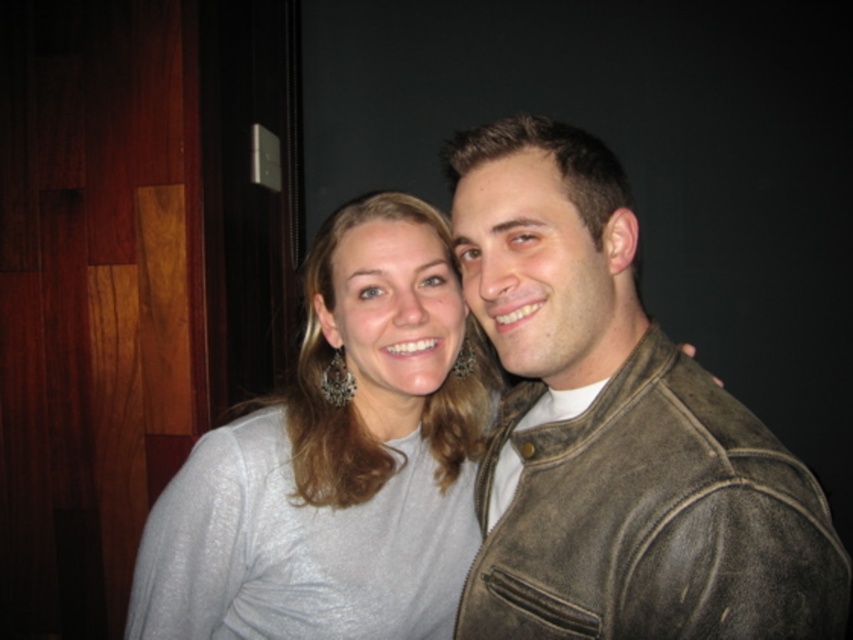
Does point (612, 268) come behind point (444, 307)?

No, (612, 268) is in front of (444, 307).

Which of these two, distressed leather jacket at right or gray matte sweater at center, stands taller?

With more height is gray matte sweater at center.

Is point (509, 260) closer to viewer compared to point (345, 275)?

Yes, it is.

This screenshot has width=853, height=640. I want to click on distressed leather jacket at right, so click(x=614, y=429).